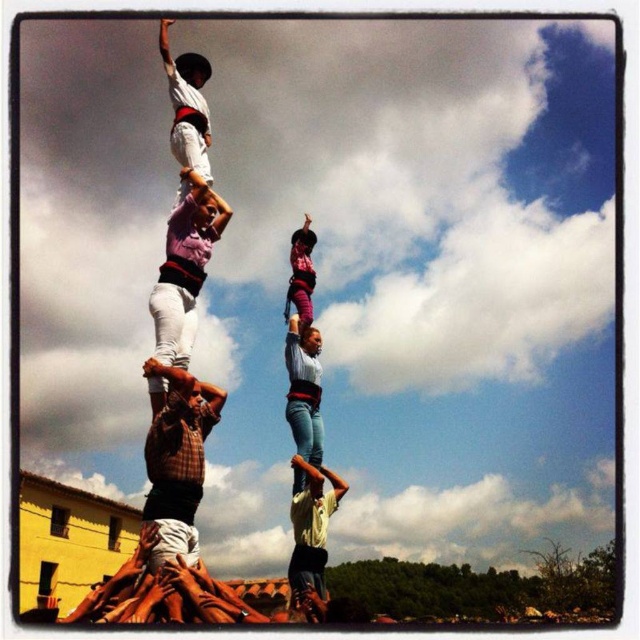
You are a photographer standing at the base of the human tower. You see the white cotton shirt at upper center and the blue jeans at center. Which one is higher up?

The white cotton shirt at upper center is located above the blue jeans at center, so it is higher up.

You are a photographer standing in front of the human tower. You notice two people in the tower wearing a light yellow shirt at center and blue jeans at center. Which clothing item is more visible to you?

The light yellow shirt at center is closer to the viewer than the blue jeans at center, so it is more visible.